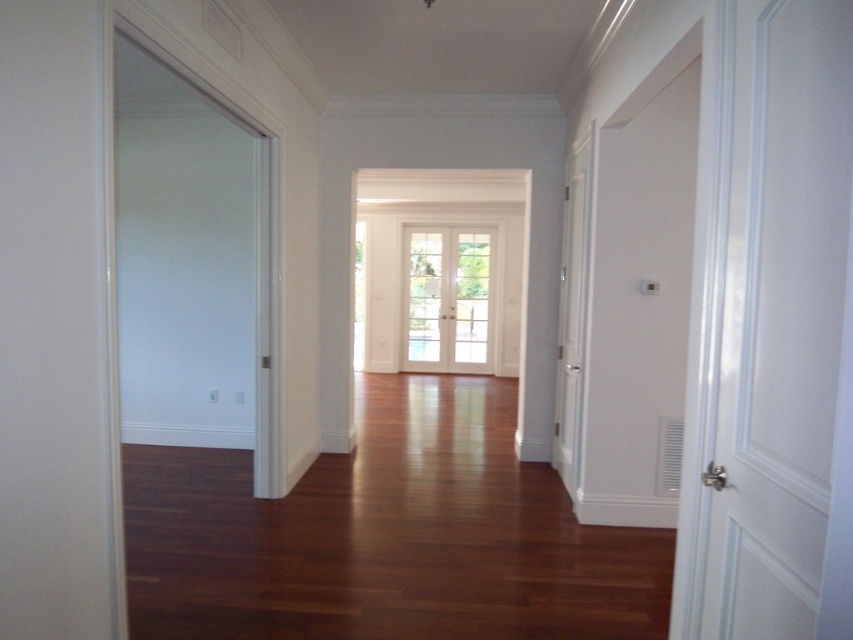
Question: Which object appears closest to the camera in this image?

Choices:
 (A) white matte door at right
 (B) white glossy door at upper right

Answer: (A)

Question: Does white matte door at right appear on the right side of clear glass door at center?

Choices:
 (A) yes
 (B) no

Answer: (A)

Question: Which of these objects is positioned closest to the clear glass door at center?

Choices:
 (A) white matte door at right
 (B) white glossy door at upper right

Answer: (B)

Question: Which object is closer to the camera taking this photo?

Choices:
 (A) clear glass door at center
 (B) white matte door at right
 (C) white glossy door at upper right

Answer: (B)

Question: Can you confirm if white glossy door at upper right is positioned above clear glass door at center?

Choices:
 (A) no
 (B) yes

Answer: (A)

Question: Is white matte door at right behind white glossy door at upper right?

Choices:
 (A) yes
 (B) no

Answer: (B)